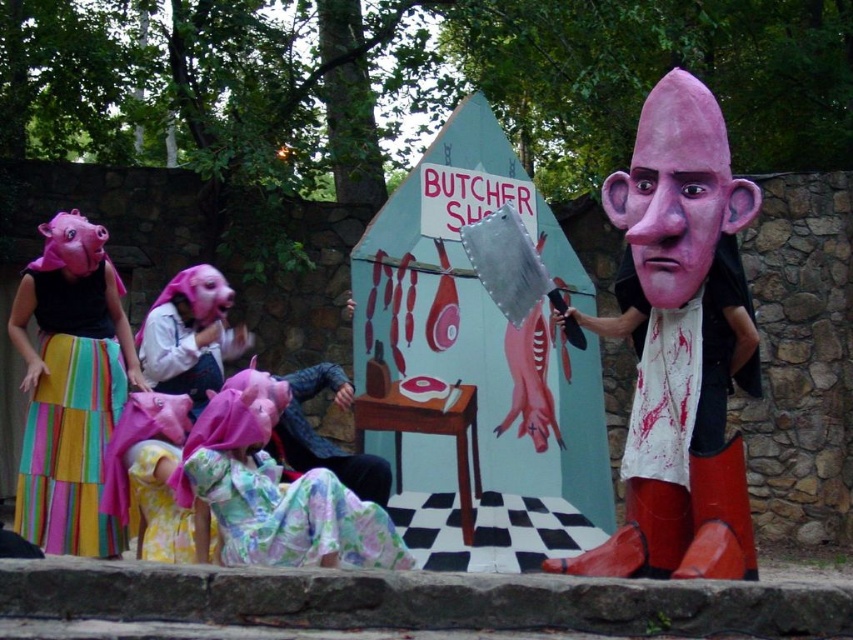
You are a stagehand preparing to place two props on a shelf. The shelf has a width of 1.2 meters. The matte pink head at right and the smooth plastic head at center right are both needed. Based on their widths, can both fit side by side on the shelf without overlapping?

The matte pink head at right might be wider than smooth plastic head at center right. However, since the total width of both together could be up to 1.2 meters or more, it is uncertain if they will fit without overlapping. Further measurements are needed to confirm.

In the scene shown: You are a stage director observing the scene. You need to place a spotlight that can cover both the matte pink head at right and the multicolored fabric skirt at left. Based on their widths, will the spotlight need to be adjusted to a wider angle to accommodate both?

The matte pink head at right might be wider than multicolored fabric skirt at left, so the spotlight may need to be adjusted to a wider angle to ensure both are fully illuminated.

Looking at this image, you are a stagehand preparing to move the floral fabric dress at center and the smooth plastic head at center right. Based on their positions, which object is closer to you?

The floral fabric dress at center is closer to you since it is in front of the smooth plastic head at center right.